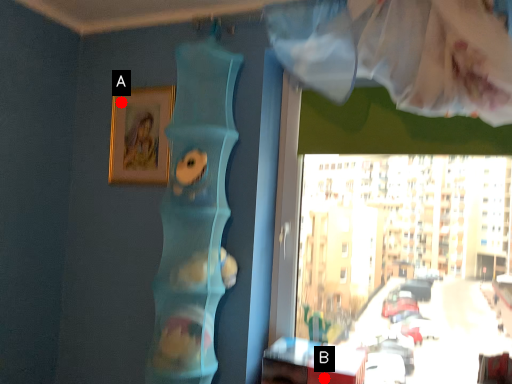
Question: Two points are circled on the image, labeled by A and B beside each circle. Which point is closer to the camera?

Choices:
 (A) A is closer
 (B) B is closer

Answer: (B)